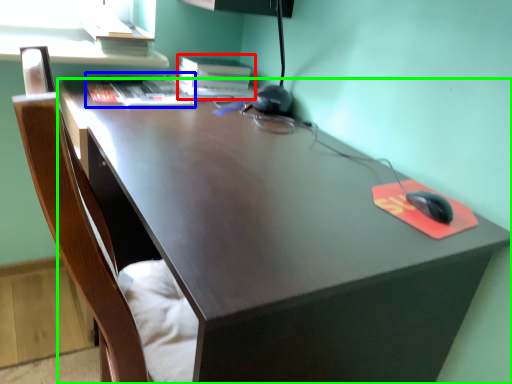
Question: Considering the real-world distances, which object is closest to book (highlighted by a red box)? book (highlighted by a blue box) or desk (highlighted by a green box).

Choices:
 (A) book
 (B) desk

Answer: (A)